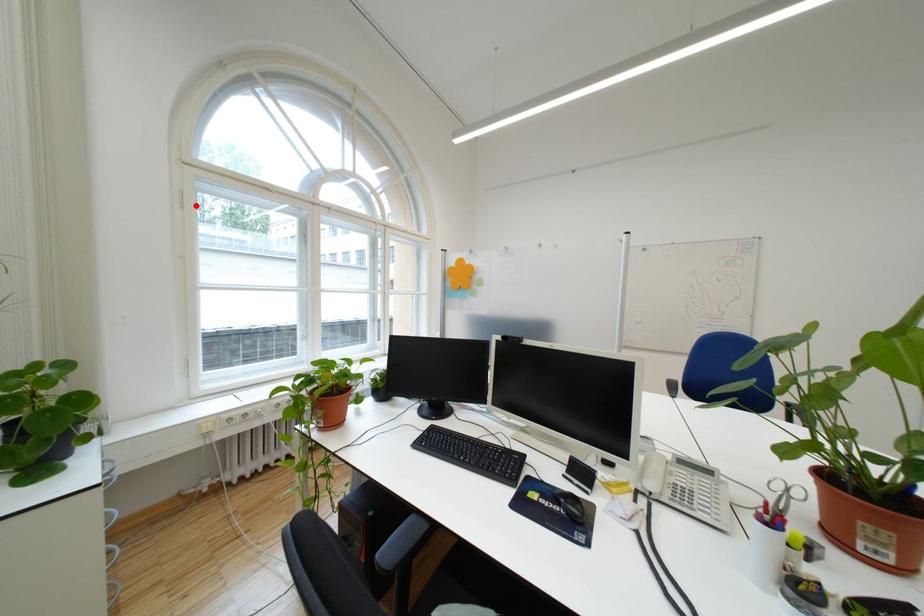
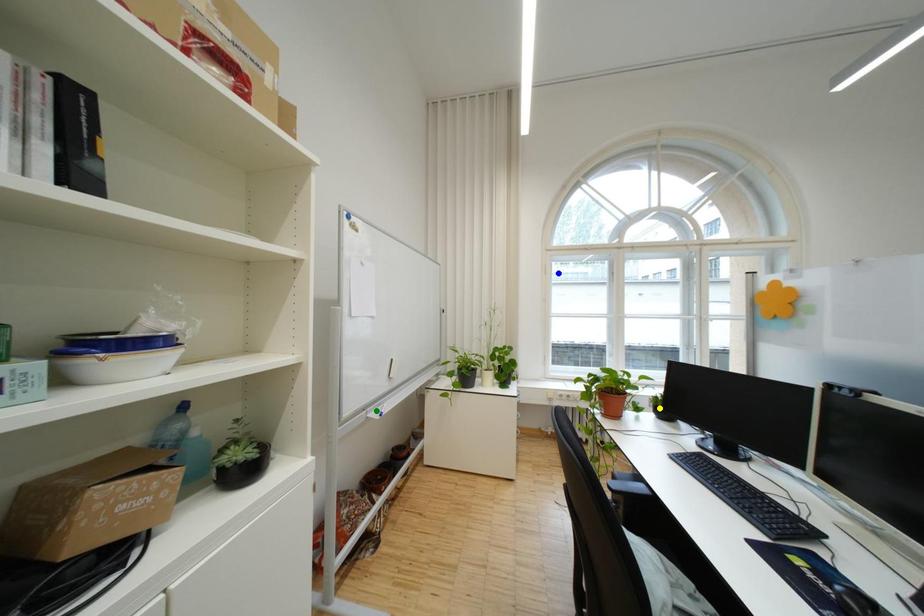
Question: I am providing you with two images of the same scene from different viewpoints. A red point is marked on the first image. You are given multiple points on the second image. Which spot in image 2 lines up with the point in image 1?

Choices:
 (A) yellow point
 (B) green point
 (C) blue point

Answer: (C)